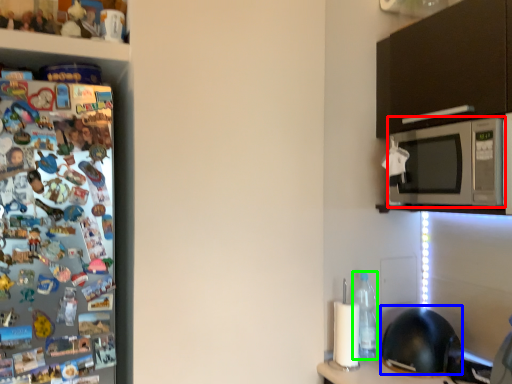
Question: Considering the real-world distances, which object is farthest from microwave oven (highlighted by a red box)? helmet (highlighted by a blue box) or bottle (highlighted by a green box)?

Choices:
 (A) helmet
 (B) bottle

Answer: (A)